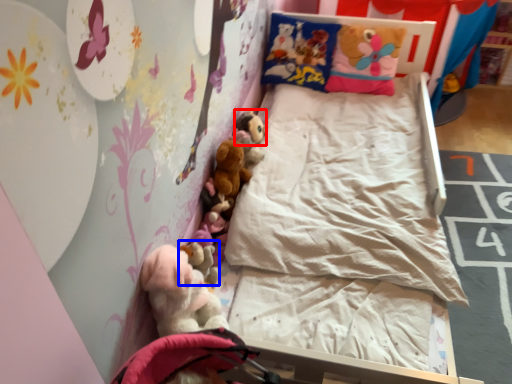
Question: Which object is closer to the camera taking this photo, toy (highlighted by a red box) or toy (highlighted by a blue box)?

Choices:
 (A) toy
 (B) toy

Answer: (B)